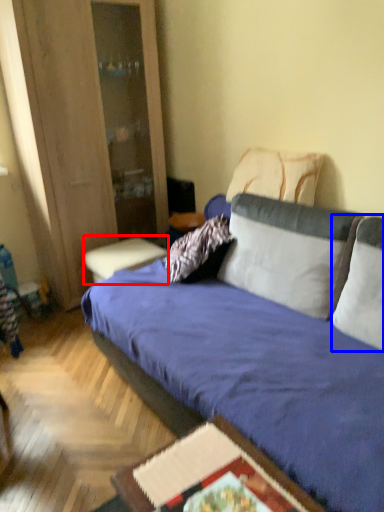
Question: Which object appears farthest to the camera in this image, table (highlighted by a red box) or pillow (highlighted by a blue box)?

Choices:
 (A) table
 (B) pillow

Answer: (A)